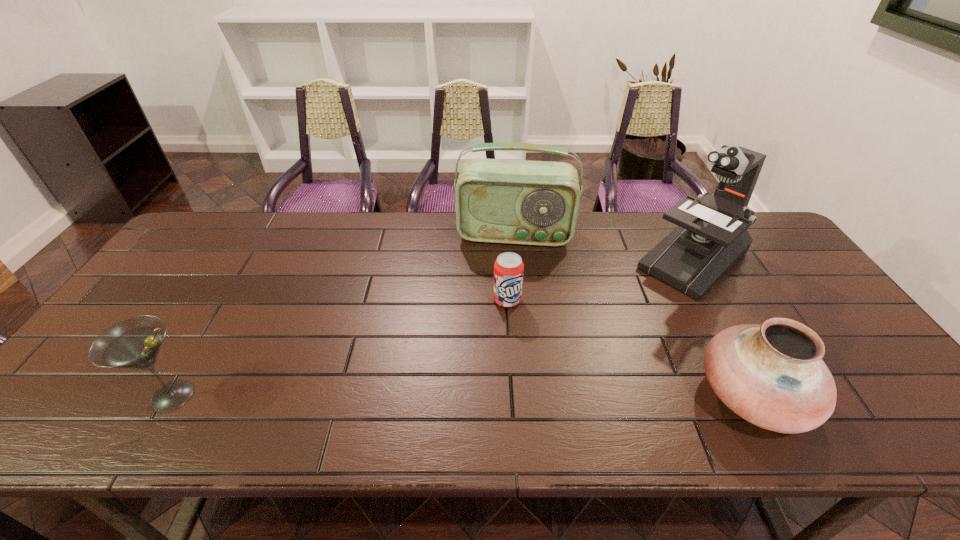
Where is `free point that satisfies the following two spatial constraints: 1. on the front side of the second tallest object; 2. on the left side of the pottery`? This screenshot has width=960, height=540. free point that satisfies the following two spatial constraints: 1. on the front side of the second tallest object; 2. on the left side of the pottery is located at coordinates (530, 395).